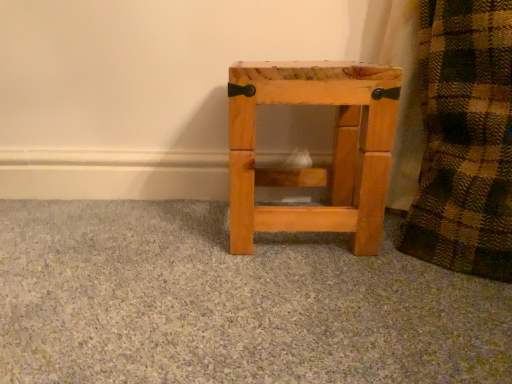
Question: From the image's perspective, is natural wood stool at center above or below natural wood stool at center?

Choices:
 (A) above
 (B) below

Answer: (A)

Question: Is point (335, 122) positioned closer to the camera than point (246, 362)?

Choices:
 (A) closer
 (B) farther

Answer: (B)

Question: Is natural wood stool at center situated inside natural wood stool at center or outside?

Choices:
 (A) outside
 (B) inside

Answer: (A)

Question: Relative to natural wood stool at center, is natural wood stool at center in front or behind?

Choices:
 (A) behind
 (B) front

Answer: (B)

Question: Is point (157, 211) positioned closer to the camera than point (278, 173)?

Choices:
 (A) farther
 (B) closer

Answer: (B)

Question: From the image's perspective, is natural wood stool at center positioned above or below natural wood stool at center?

Choices:
 (A) below
 (B) above

Answer: (A)

Question: Looking at the image, does natural wood stool at center seem bigger or smaller compared to natural wood stool at center?

Choices:
 (A) small
 (B) big

Answer: (B)